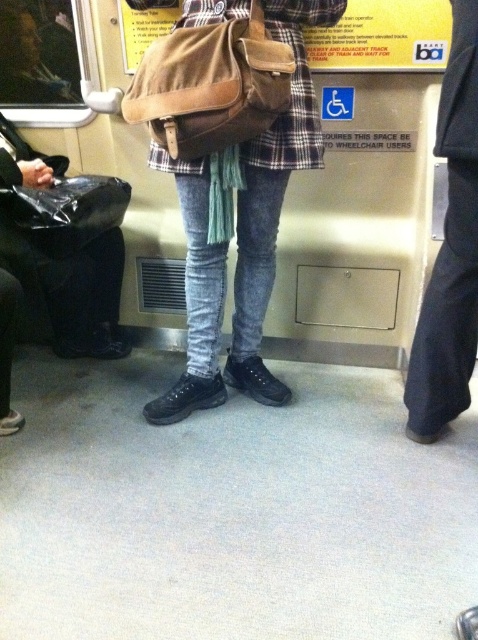
You are a passenger on the train and you see the dark blue fabric at right and the black plastic bag at left. Which object is higher in height?

The dark blue fabric at right is taller than the black plastic bag at left.

You are a passenger on a train and you have two bags with you. You notice a matte brown bag at center and a black plastic bag at left. Which bag is taller?

The matte brown bag at center is taller than the black plastic bag at left.

You are a passenger on a train and need to store your items. You have a dark blue fabric at right and a brown suede bag at center. Which item takes up more space?

The dark blue fabric at right is larger in size than the brown suede bag at center, so it takes up more space.